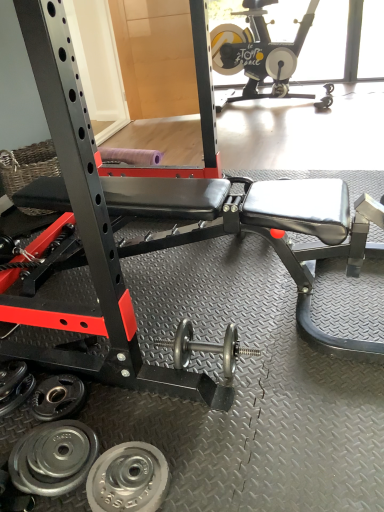
The width and height of the screenshot is (384, 512). In order to click on vacant space to the right of silver metallic weight plate at lower left, which ranks as the 1th wheel in back-to-front order in this screenshot , I will do `click(111, 408)`.